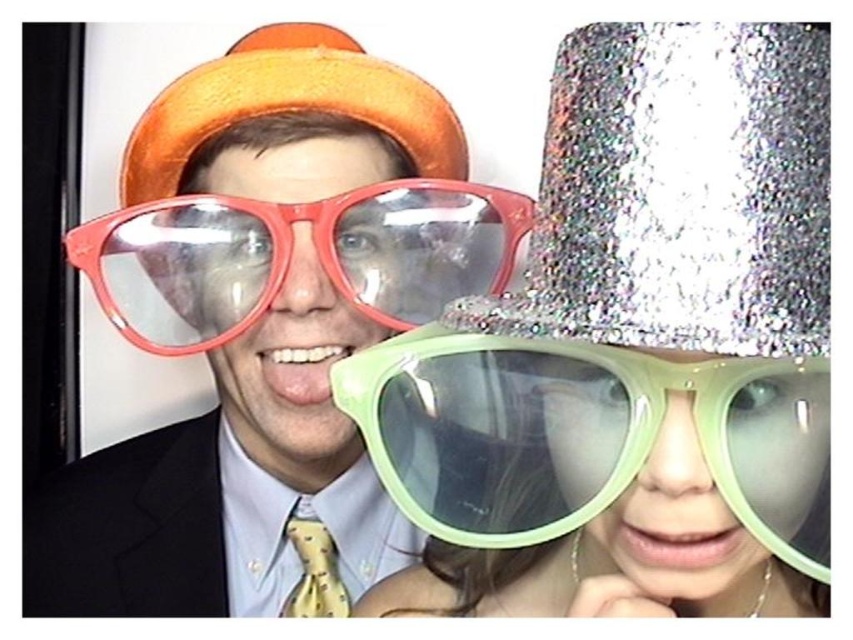
Question: Among these objects, which one is nearest to the camera?

Choices:
 (A) glittery silver hat at upper right
 (B) orange felt hat at upper center
 (C) matte orange hat at upper left

Answer: (A)

Question: Is matte orange hat at upper left thinner than orange felt hat at upper center?

Choices:
 (A) yes
 (B) no

Answer: (B)

Question: Which point is farther to the camera?

Choices:
 (A) (556, 106)
 (B) (370, 348)
 (C) (332, 560)

Answer: (C)

Question: Is green matte sunglasses at center positioned at the back of green translucent sunglasses at center?

Choices:
 (A) yes
 (B) no

Answer: (B)

Question: Can you confirm if green matte sunglasses at center is wider than translucent plastic goggles at center?

Choices:
 (A) yes
 (B) no

Answer: (B)

Question: Considering the real-world distances, which object is farthest from the yellow dotted tie at center?

Choices:
 (A) translucent plastic goggles at center
 (B) orange felt hat at upper center
 (C) glittery silver hat at upper right

Answer: (C)